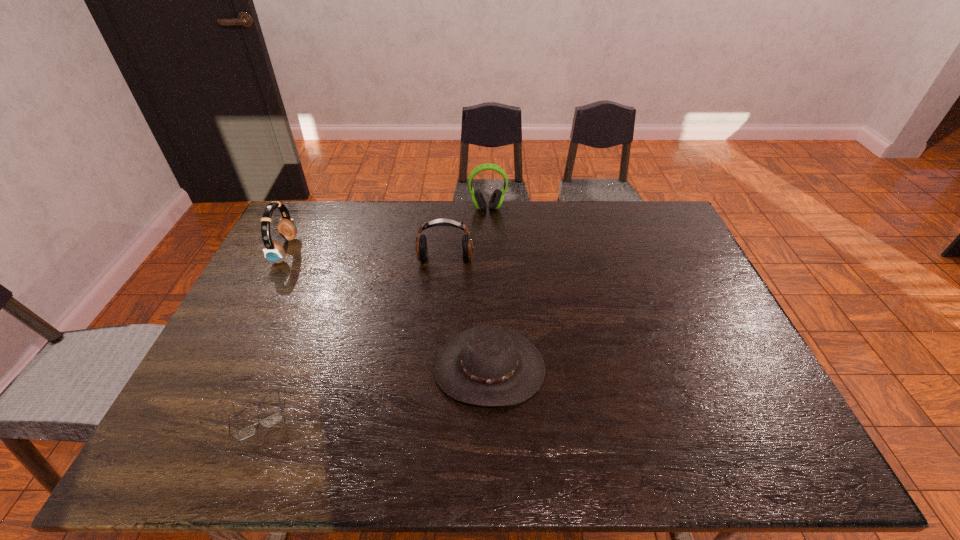
Locate an element on the screen. Image resolution: width=960 pixels, height=540 pixels. free space between the farthest object and the leftmost headset is located at coordinates (387, 229).

Where is `free point between the fourth object from right to left and the farthest object`? This screenshot has width=960, height=540. free point between the fourth object from right to left and the farthest object is located at coordinates (373, 313).

Where is `free point between the fourth object from right to left and the farthest object`? The image size is (960, 540). free point between the fourth object from right to left and the farthest object is located at coordinates (373, 313).

You are a GUI agent. You are given a task and a screenshot of the screen. Output one action in this format:
    pyautogui.click(x=<x>, y=<y>)
    Task: Click on the vacant space that is in between the farthest object and the leftmost object
    The image size is (960, 540).
    Given the screenshot: What is the action you would take?
    pyautogui.click(x=387, y=229)

Select which object is the fourth closest to the farthest headset. Please provide its 2D coordinates. Your answer should be formatted as a tuple, i.e. [(x, y)], where the tuple contains the x and y coordinates of a point satisfying the conditions above.

[(275, 418)]

Identify the location of the fourth closest object to the spectacles. (497, 197).

Locate an element on the screen. headset that is the second nearest to the second object from left to right is located at coordinates (421, 242).

Find the location of `the second closest headset to the farthest object`. the second closest headset to the farthest object is located at coordinates (274, 251).